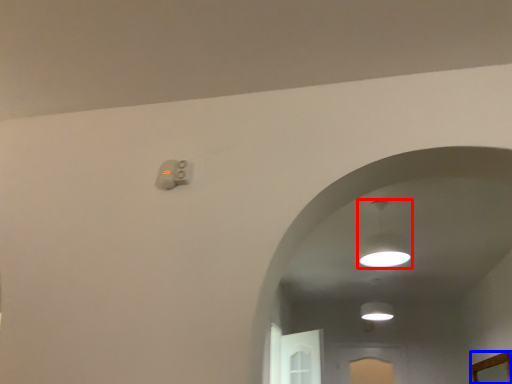
Question: Which point is further to the camera, lamp (highlighted by a red box) or mirror (highlighted by a blue box)?

Choices:
 (A) lamp
 (B) mirror

Answer: (B)